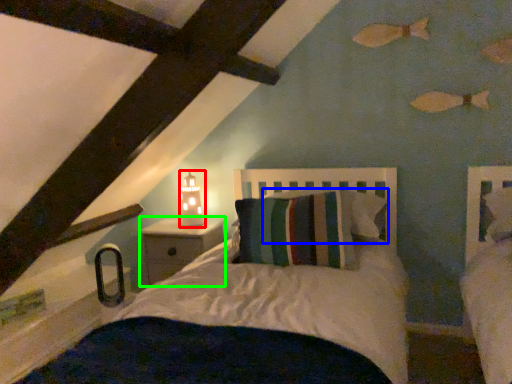
Question: Considering the real-world distances, which object is closest to table lamp (highlighted by a red box)? pillow (highlighted by a blue box) or nightstand (highlighted by a green box).

Choices:
 (A) pillow
 (B) nightstand

Answer: (B)